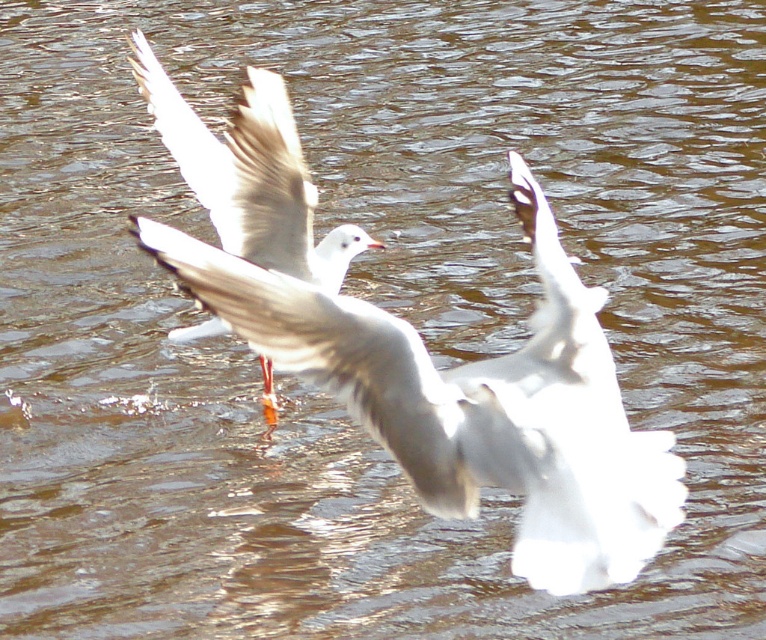
You are an ornithologist observing a seagull in flight. You notice the white feathered wing at center and the white feathered bird at center. Which object is positioned lower in the image?

The white feathered wing at center is positioned lower than the white feathered bird at center.